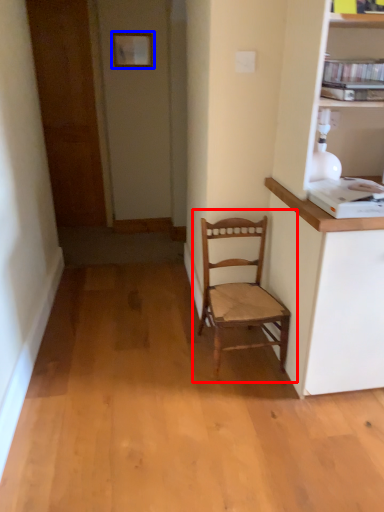
Question: Which object appears farthest to the camera in this image, chair (highlighted by a red box) or picture frame (highlighted by a blue box)?

Choices:
 (A) chair
 (B) picture frame

Answer: (B)